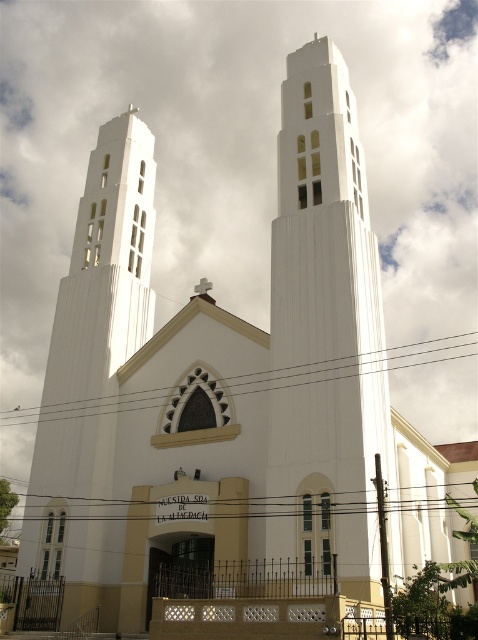
You are standing in front of the church and notice a point marked at coordinates (325,326). Based on the church description, what architectural feature is located at that point?

The point at coordinates (325,326) corresponds to the white smooth tower at center.

You are standing in front of the church and want to take a photo of the white smooth tower at center. If your camera can focus on objects up to 100 feet away, will it be able to capture the tower clearly?

The white smooth tower at center is 121.80 feet away from the camera, which exceeds the camera maximum focus range of 100 feet. Therefore, the camera cannot capture the tower clearly.

You are standing in front of the church and want to take a photo that includes both the white smooth tower at center and the white smooth tower at left. Which tower should you position closer to the camera to ensure both are in focus?

You should position the white smooth tower at center closer to the camera since it is already closer to the viewer than the white smooth tower at left, ensuring both are in focus.